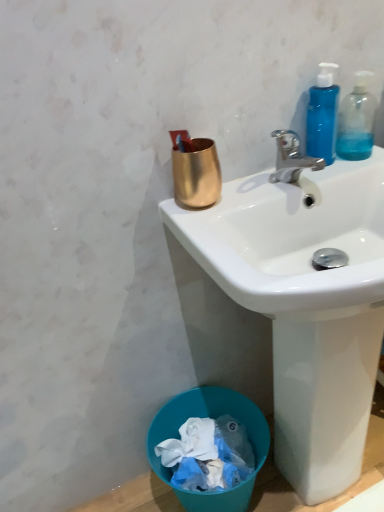
The image size is (384, 512). What are the coordinates of `free location to the right of polished chrome faucet at upper right` in the screenshot? It's located at (339, 167).